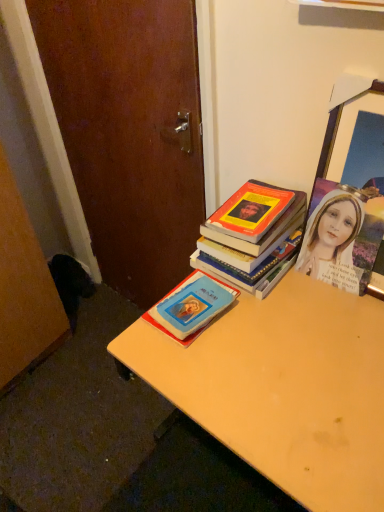
At what (x,y) coordinates should I click in order to perform the action: click on free space between hardcover book at center, which is the second book from bottom to top, and wooden picture frame at upper right. Please return your answer as a coordinate pair (x, y). This screenshot has height=512, width=384. Looking at the image, I should click on (311, 296).